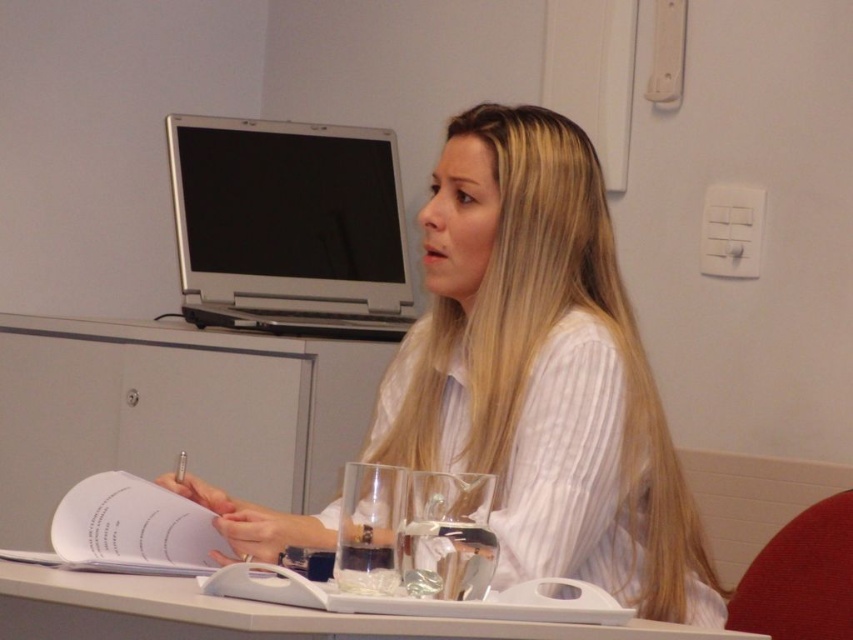
Question: Which point is closer to the camera?

Choices:
 (A) white striped shirt at center
 (B) white plastic tray at center
 (C) clear glass wine glass at center

Answer: (B)

Question: Can you confirm if silver metallic laptop at upper center is positioned above white plastic tray at center?

Choices:
 (A) no
 (B) yes

Answer: (B)

Question: Can you confirm if white striped shirt at center is positioned to the left of clear glass wine glass at center?

Choices:
 (A) no
 (B) yes

Answer: (A)

Question: Which object is farther from the camera taking this photo?

Choices:
 (A) silver metallic laptop at upper center
 (B) white striped shirt at center
 (C) white plastic tray at center

Answer: (A)

Question: Which of the following is the closest to the observer?

Choices:
 (A) (550, 289)
 (B) (424, 564)

Answer: (B)

Question: Where is white striped shirt at center located in relation to clear glass wine glass at center in the image?

Choices:
 (A) above
 (B) below

Answer: (A)